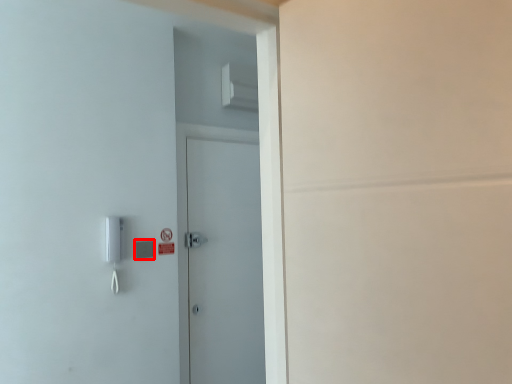
Question: Where is light switch (annotated by the red box) located in relation to door in the image?

Choices:
 (A) right
 (B) left

Answer: (B)